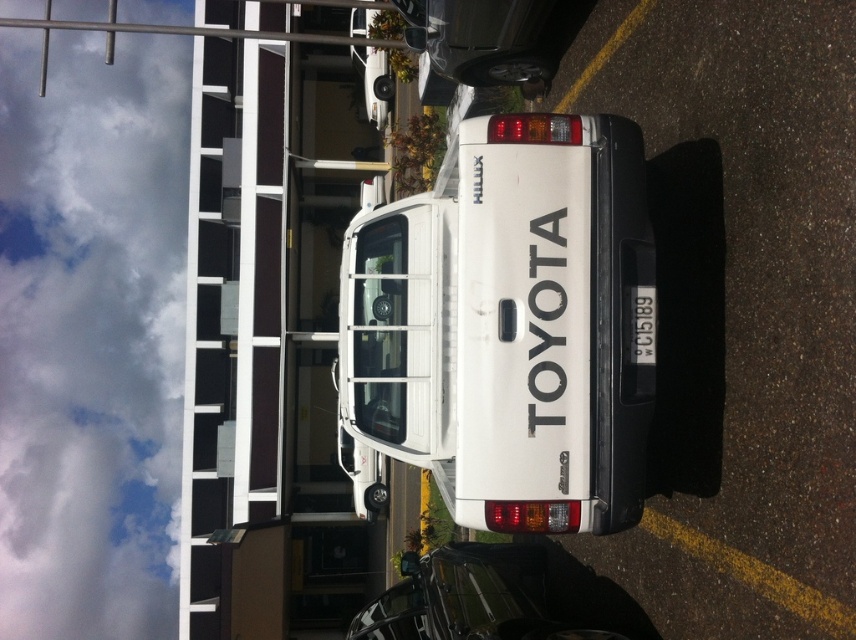
You are standing in front of the white Toyota Hilux pickup truck parked near the modern building. There are two points marked on the ground. The first point is at coordinate point (566, 364) and the second point is at coordinate point (640, 344). If you are facing the truck, which point is closer to you?

Point (566, 364) is in front of point (640, 344), so the first point is closer to you.

You are a delivery person trying to park your truck in a narrow alley. The alley is only as wide as the white plastic license plate at center. Can your truck, which is the same size as the white matte truck at center, fit through the alley?

The white matte truck at center is wider than the white plastic license plate at center, so the alley is narrower than the truck. Therefore, the truck cannot fit through the alley.

You are a delivery driver who needs to park your white matte truck at center in a specific spot. The parking spot is marked at coordinates 0.508, 0.595. Is your truck already in the correct parking spot?

Yes, the white matte truck at center is already positioned at the coordinates (508, 324), so it is in the correct parking spot.